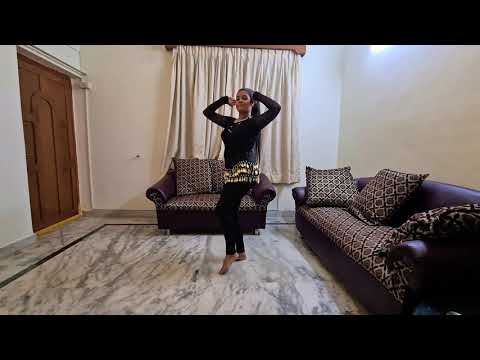
Find the location of `wall`. wall is located at coordinates (15, 192), (108, 109), (438, 118).